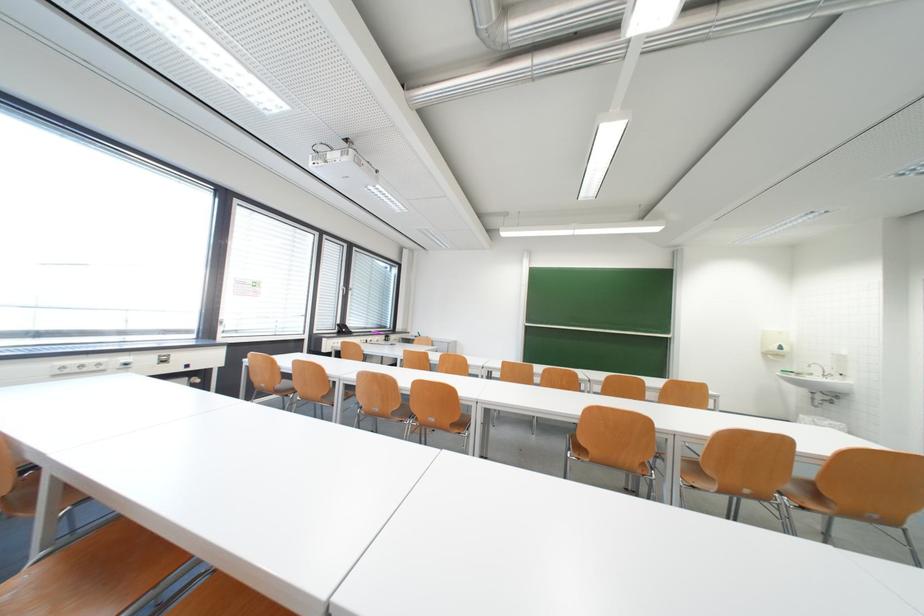
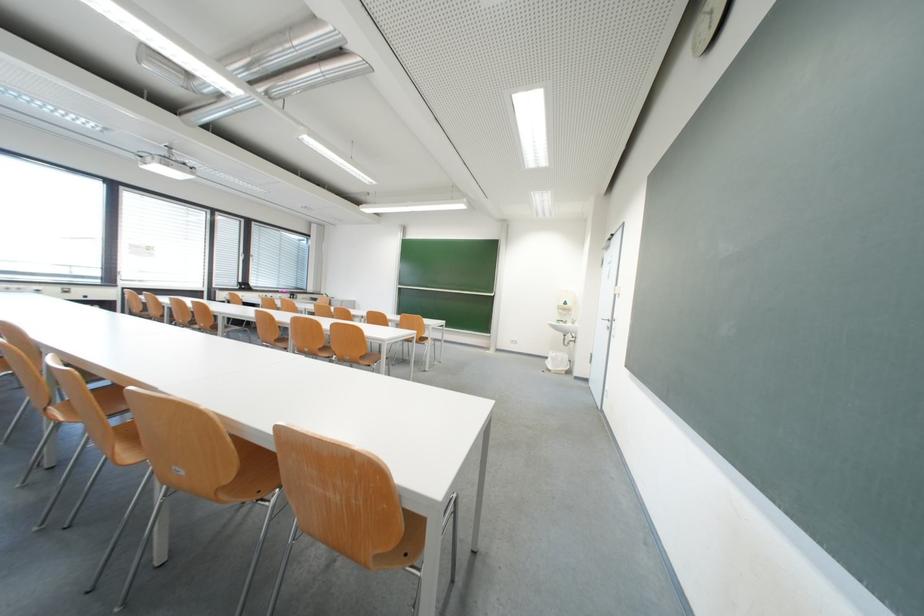
Where in the second image is the point corresponding to the point at 800,378 from the first image?

(570, 326)